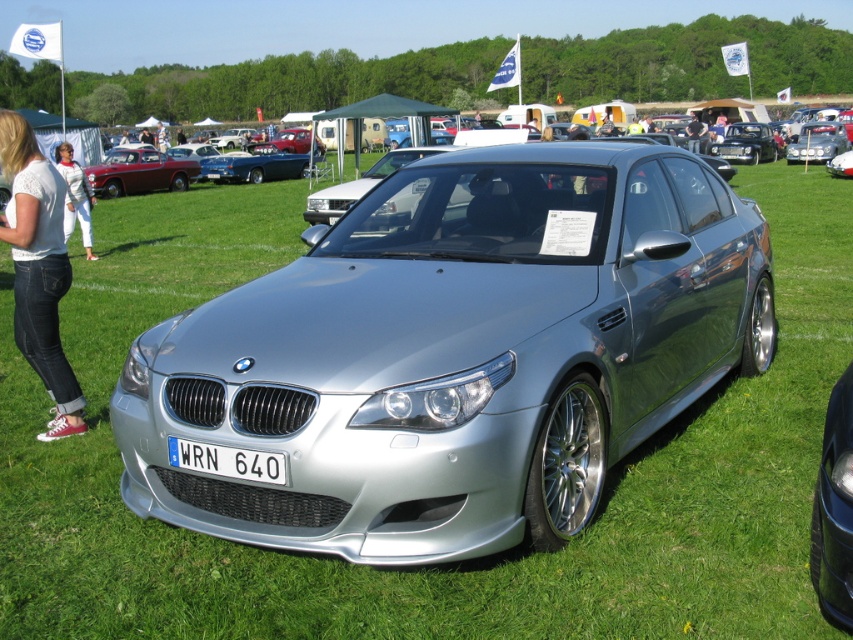
Question: Is white plastic license plate at center further to camera compared to white fabric pants at left?

Choices:
 (A) no
 (B) yes

Answer: (A)

Question: Does denim jeans at lower left appear on the left side of silver metallic car at center?

Choices:
 (A) no
 (B) yes

Answer: (B)

Question: Which of the following is the farthest from the observer?

Choices:
 (A) shiny maroon sedan at left
 (B) white fabric pants at left
 (C) silver metallic car at center

Answer: (A)

Question: Is denim jeans at lower left to the left of shiny maroon sedan at left from the viewer's perspective?

Choices:
 (A) yes
 (B) no

Answer: (B)

Question: Estimate the real-world distances between objects in this image. Which object is closer to the white plastic license plate at center?

Choices:
 (A) denim jeans at lower left
 (B) shiny maroon sedan at left

Answer: (A)

Question: Among these objects, which one is nearest to the camera?

Choices:
 (A) denim jeans at lower left
 (B) silver metallic car at center
 (C) white fabric pants at left

Answer: (B)